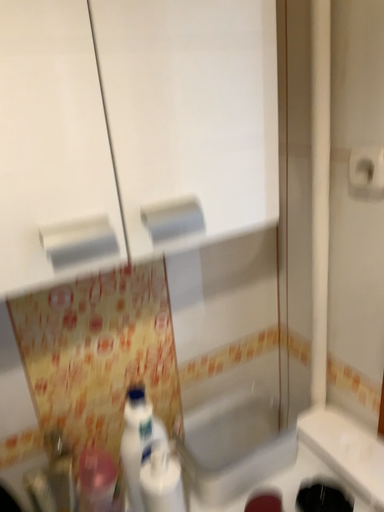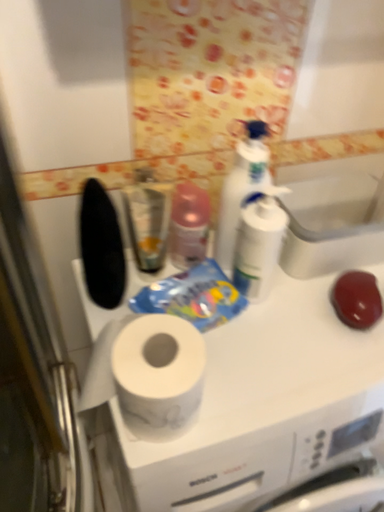
Question: Which way did the camera rotate in the video?

Choices:
 (A) rotated downward
 (B) rotated upward

Answer: (A)